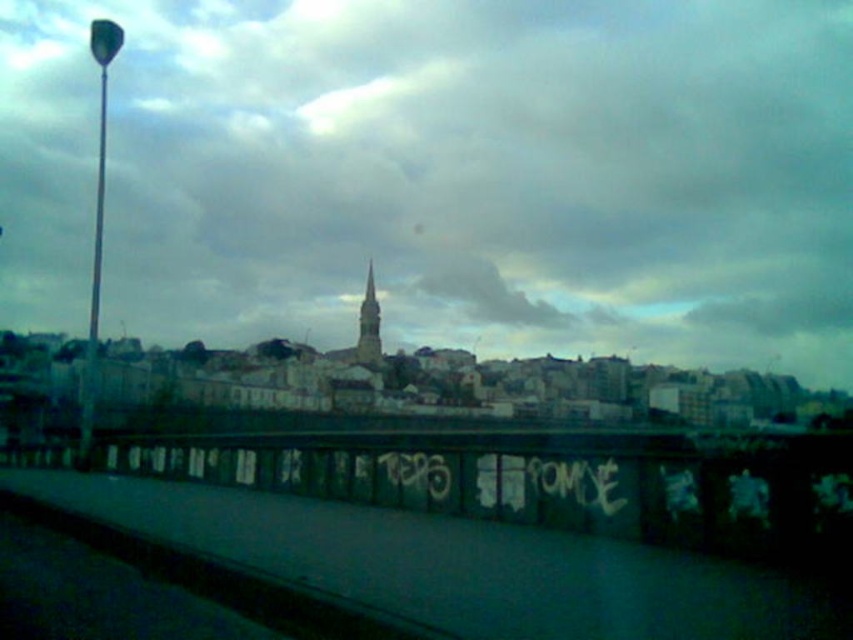
Between point (643, 508) and point (378, 348), which one is positioned behind?

Point (378, 348)

Can you confirm if concrete wall at lower center is shorter than smooth stone spire at center?

Indeed, concrete wall at lower center has a lesser height compared to smooth stone spire at center.

Locate an element on the screen. concrete wall at lower center is located at coordinates (515, 504).

At what (x,y) coordinates should I click in order to perform the action: click on concrete wall at lower center. Please return your answer as a coordinate pair (x, y). The image size is (853, 640). Looking at the image, I should click on (515, 504).

Consider the image. Between cloudy sky at upper center and smooth stone spire at center, which one has less height?

smooth stone spire at center

Who is taller, cloudy sky at upper center or smooth stone spire at center?

With more height is cloudy sky at upper center.

Does point (141, 228) come in front of point (360, 321)?

No, it is not.

You are a GUI agent. You are given a task and a screenshot of the screen. Output one action in this format:
    pyautogui.click(x=<x>, y=<y>)
    Task: Click on the cloudy sky at upper center
    The height and width of the screenshot is (640, 853).
    Given the screenshot: What is the action you would take?
    pyautogui.click(x=440, y=173)

Which is more to the left, cloudy sky at upper center or concrete wall at lower center?

From the viewer's perspective, cloudy sky at upper center appears more on the left side.

Is point (13, 141) positioned behind point (804, 602)?

Yes, it is behind point (804, 602).

Describe the element at coordinates (440, 173) in the screenshot. I see `cloudy sky at upper center` at that location.

Identify the location of cloudy sky at upper center. (440, 173).